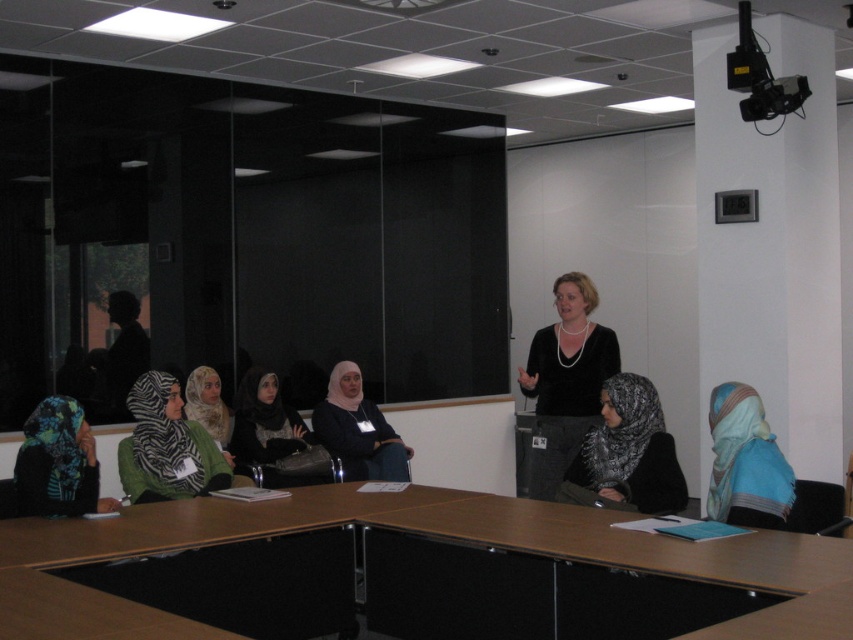
You are organizing a cultural event and need to choose between two scarves for a display. The blue patterned scarf at lower left and the light blue scarf at center. Which one is bigger?

The light blue scarf at center is bigger than the blue patterned scarf at lower left.